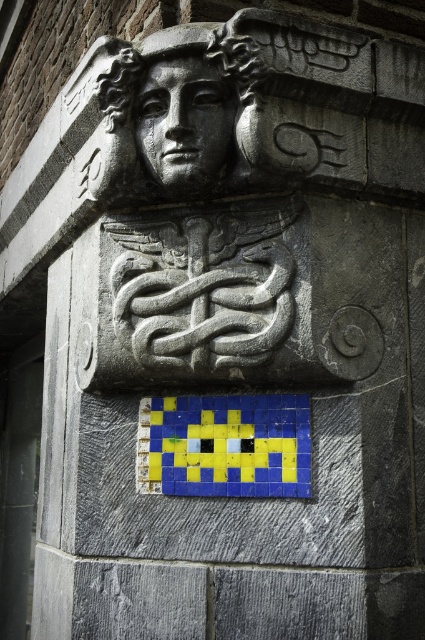
Can you confirm if pixelated yellow tile at center is shorter than gray stone face at center?

Indeed, pixelated yellow tile at center has a lesser height compared to gray stone face at center.

Is point (289, 429) less distant than point (153, 92)?

Yes, point (289, 429) is in front of point (153, 92).

What are the coordinates of `pixelated yellow tile at center` in the screenshot? It's located at (224, 445).